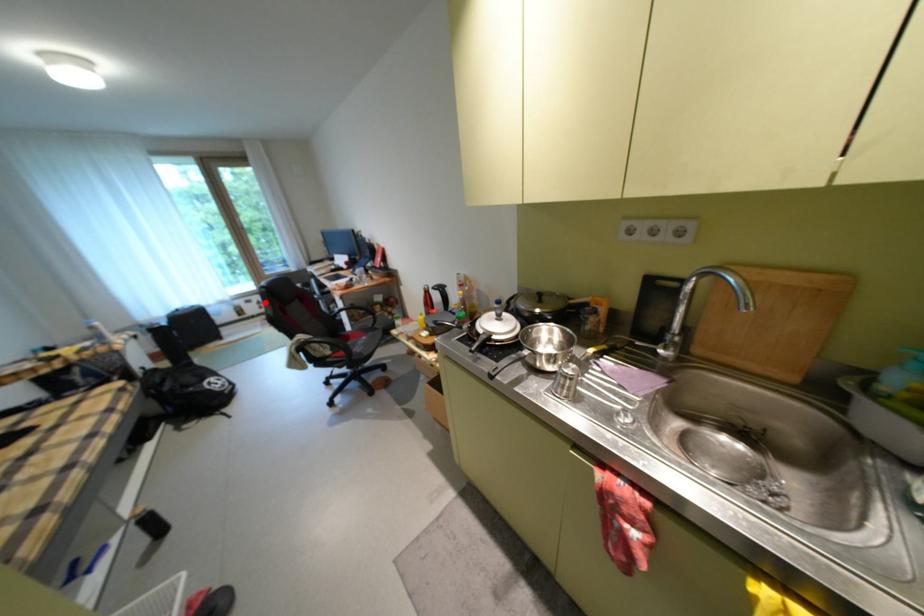
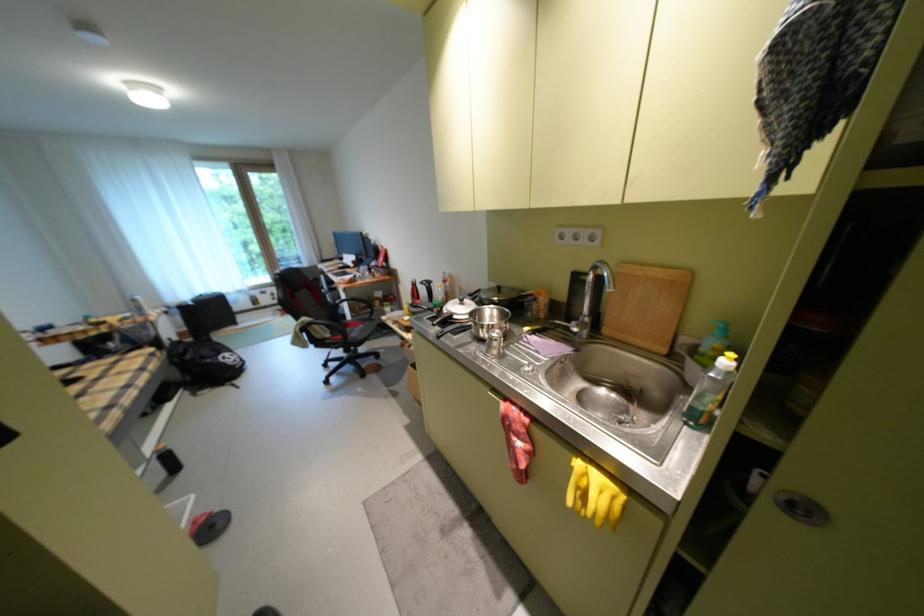
Locate, in the second image, the point that corresponds to the highlighted location in the first image.

(280, 294)